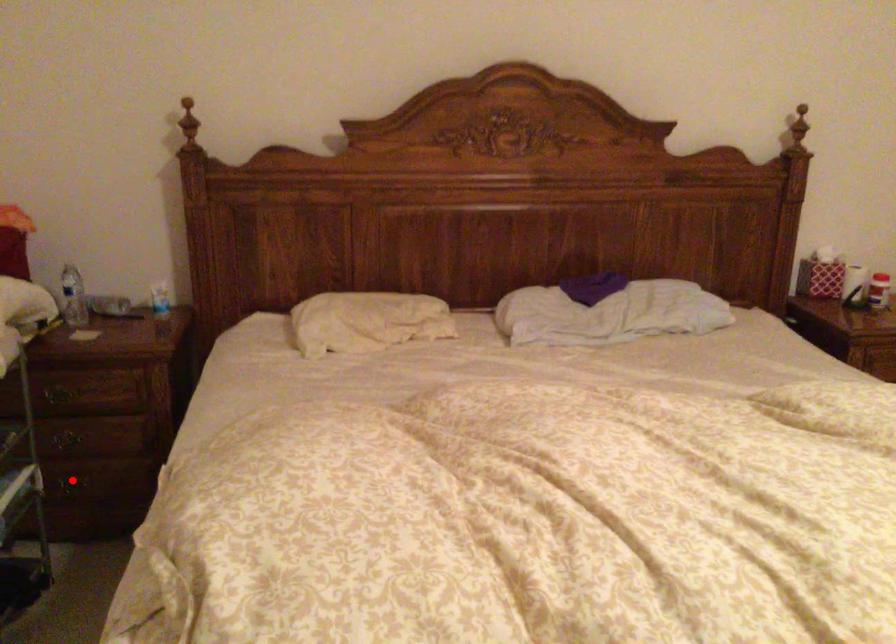
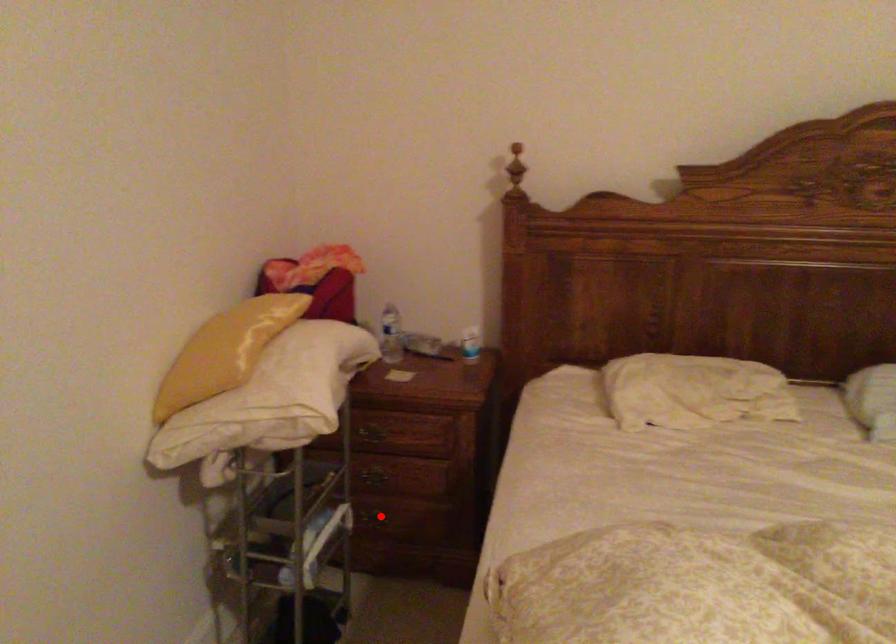
I am providing you with two images of the same scene from different viewpoints. A red point is marked on the first image and another point is marked on the second image. Is the red point in image1 aligned with the point shown in image2?

Yes